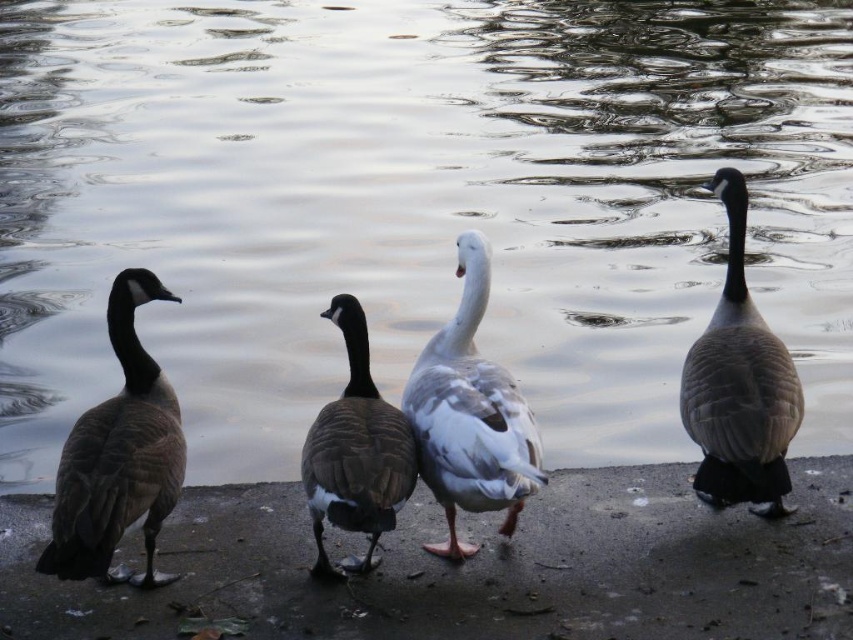
Based on the photo, is dark brown feathers at left positioned before white matte duck at center?

Yes.

Can you confirm if dark brown feathers at left is taller than white matte duck at center?

No, dark brown feathers at left is not taller than white matte duck at center.

What do you see at coordinates (119, 454) in the screenshot?
I see `dark brown feathers at left` at bounding box center [119, 454].

Identify the location of dark brown feathers at left. Image resolution: width=853 pixels, height=640 pixels. (119, 454).

Is gray concrete sidewalk at lower center thinner than brown feathered goose at right?

Incorrect, gray concrete sidewalk at lower center's width is not less than brown feathered goose at right's.

Which is more to the right, gray concrete sidewalk at lower center or brown feathered goose at right?

brown feathered goose at right is more to the right.

Locate an element on the screen. gray concrete sidewalk at lower center is located at coordinates [480, 568].

Describe the element at coordinates (119, 454) in the screenshot. The width and height of the screenshot is (853, 640). I see `dark brown feathers at left` at that location.

Between dark brown feathers at left and brown matte duck at center, which one is positioned lower?

brown matte duck at center

Does point (123, 292) lie behind point (323, 314)?

No.

You are a GUI agent. You are given a task and a screenshot of the screen. Output one action in this format:
    pyautogui.click(x=<x>, y=<y>)
    Task: Click on the dark brown feathers at left
    
    Given the screenshot: What is the action you would take?
    pyautogui.click(x=119, y=454)